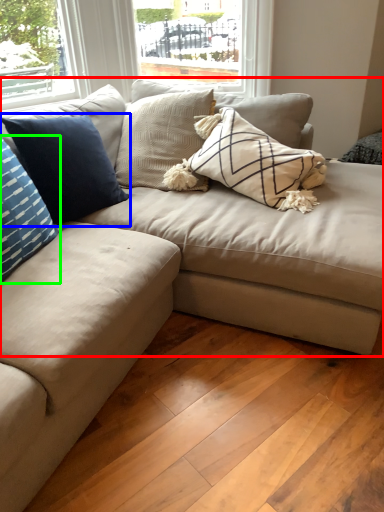
Question: Considering the real-world distances, which object is farthest from studio couch (highlighted by a red box)? pillow (highlighted by a blue box) or pillow (highlighted by a green box)?

Choices:
 (A) pillow
 (B) pillow

Answer: (B)